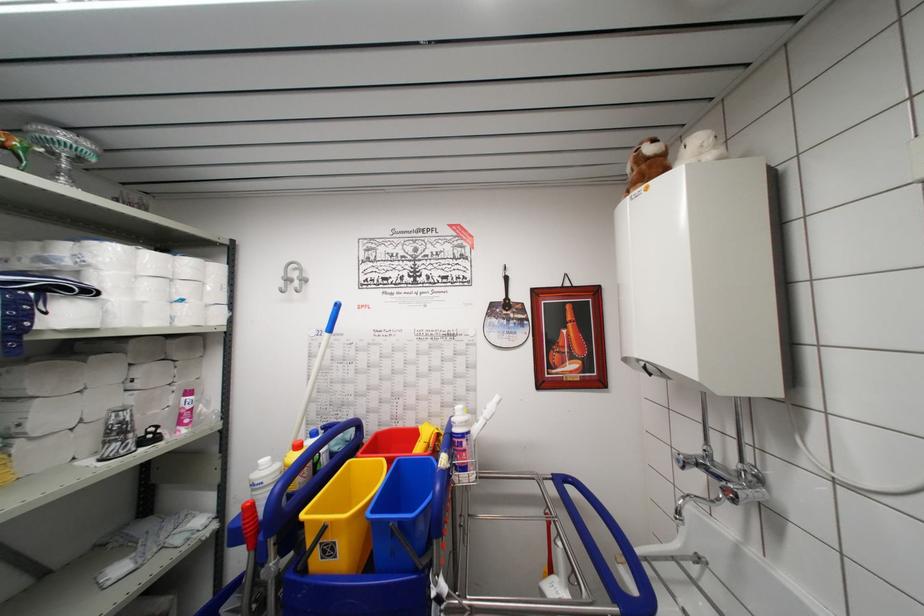
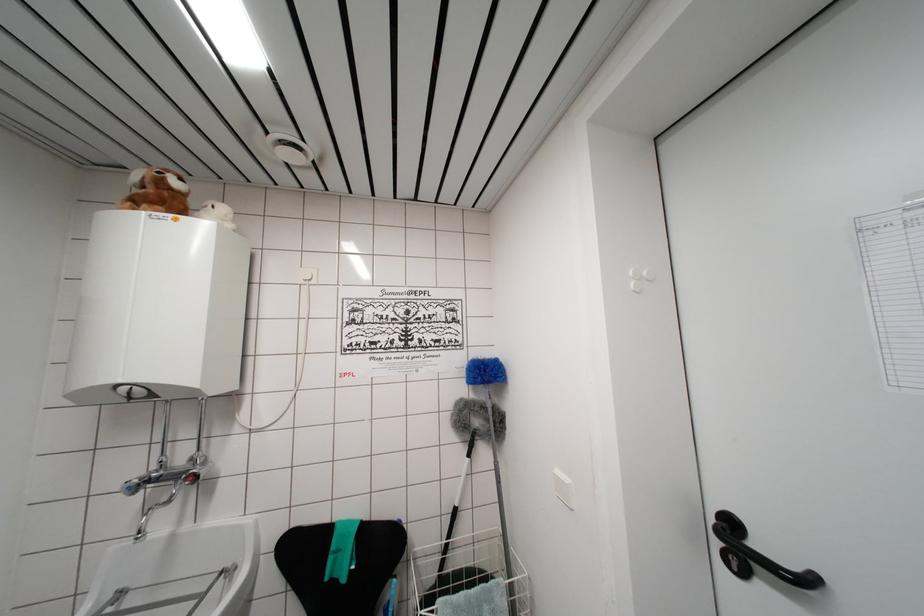
Where in the second image is the point corresponding to [649,184] from the first image?

(168, 209)